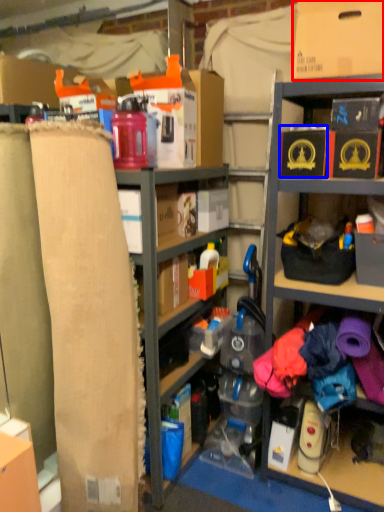
Question: Which point is further to the camera, cardboard box (highlighted by a red box) or storage box (highlighted by a blue box)?

Choices:
 (A) cardboard box
 (B) storage box

Answer: (B)